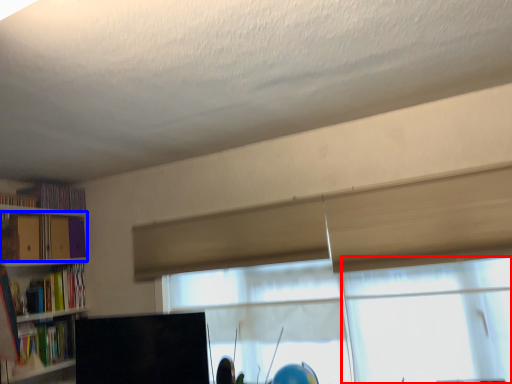
Question: Which point is further to the camera, glass door (highlighted by a red box) or book (highlighted by a blue box)?

Choices:
 (A) glass door
 (B) book

Answer: (B)